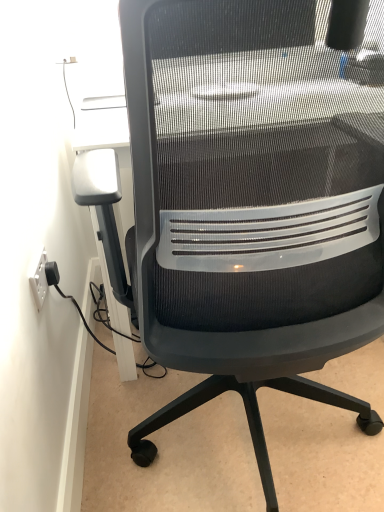
Image resolution: width=384 pixels, height=512 pixels. What do you see at coordinates (38, 277) in the screenshot?
I see `white plastic outlet at lower left` at bounding box center [38, 277].

The width and height of the screenshot is (384, 512). I want to click on white plastic outlet at lower left, so point(38,277).

Where is `white plastic outlet at lower left`? Image resolution: width=384 pixels, height=512 pixels. white plastic outlet at lower left is located at coordinates (38, 277).